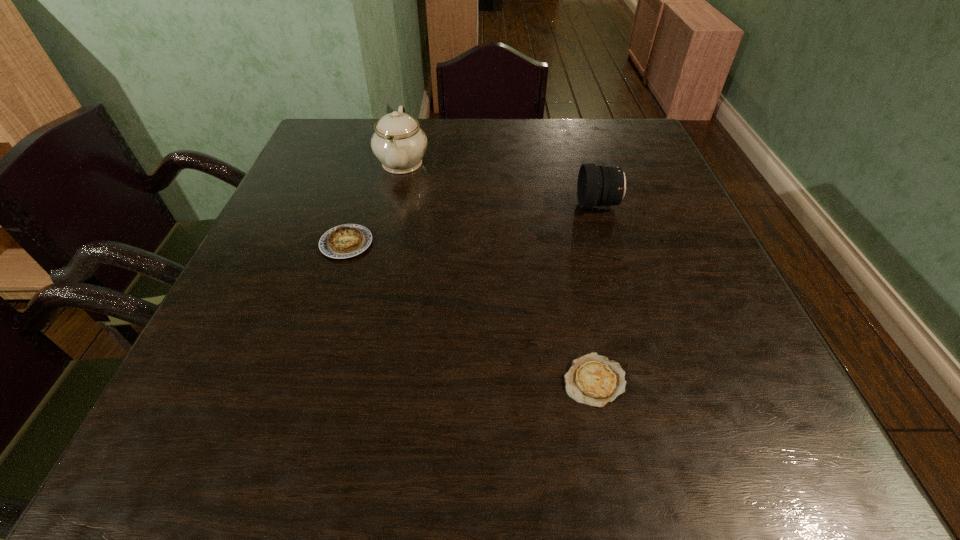
The width and height of the screenshot is (960, 540). I want to click on chinaware, so click(x=398, y=142).

The height and width of the screenshot is (540, 960). What are the coordinates of `the farthest object` in the screenshot? It's located at (398, 142).

Find the location of a particular element. The width and height of the screenshot is (960, 540). telephoto lens is located at coordinates 599,186.

What are the coordinates of `the second tallest object` in the screenshot? It's located at (599, 186).

Find the location of a particular element. This screenshot has height=540, width=960. the second shortest object is located at coordinates (344, 241).

You are a GUI agent. You are given a task and a screenshot of the screen. Output one action in this format:
    pyautogui.click(x=<x>, y=<y>)
    Task: Click on the left quiche
    
    Given the screenshot: What is the action you would take?
    [344, 241]

This screenshot has height=540, width=960. I want to click on the nearer quiche, so click(x=592, y=379).

Find the location of a particular element. Image resolution: width=960 pixels, height=540 pixels. the nearest object is located at coordinates (592, 379).

The height and width of the screenshot is (540, 960). Identify the location of free space located 0.220m at the spout of the chinaware. (384, 245).

Where is `free space located 0.180m at the front element of the second tallest object`? The width and height of the screenshot is (960, 540). free space located 0.180m at the front element of the second tallest object is located at coordinates (501, 205).